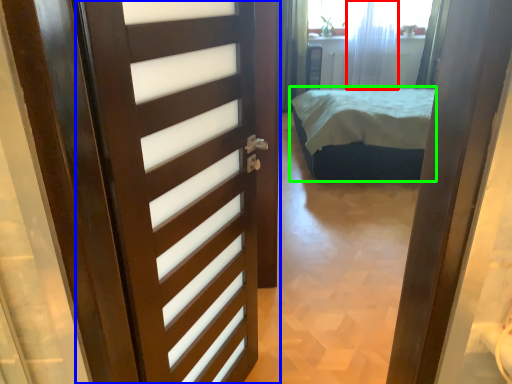
Question: Based on their relative distances, which object is nearer to curtain (highlighted by a red box)? Choose from door (highlighted by a blue box) and bed (highlighted by a green box).

Choices:
 (A) door
 (B) bed

Answer: (B)